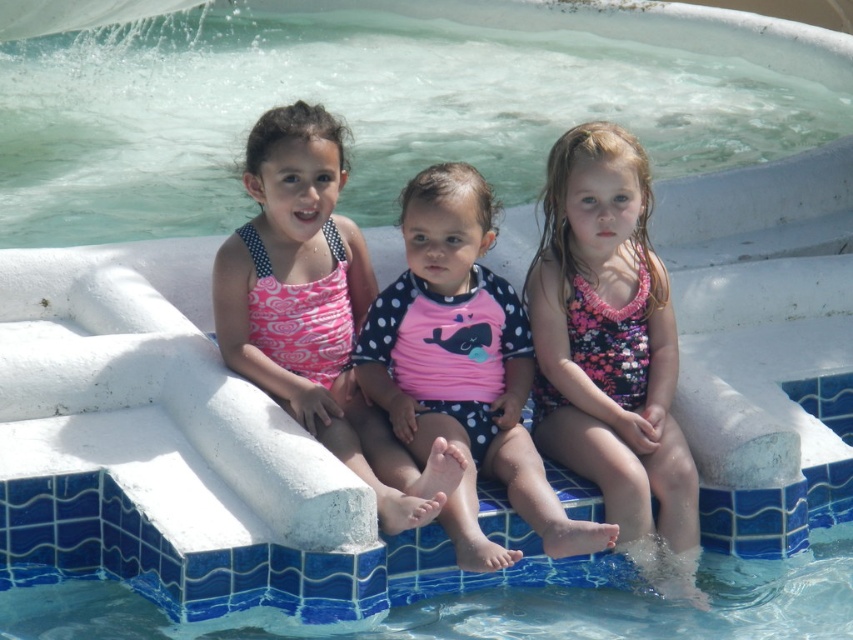
Consider the image. You are a lifeguard trying to ensure swimwear fits properly. You notice two children wearing pink swimsuits. One has a pink floral swimsuit at center and the other has a pink polka dot swimsuit at left. Which child is wearing the wider swimsuit?

The pink floral swimsuit at center is wider than the pink polka dot swimsuit at left, so the child wearing the pink floral swimsuit at center has the wider swimsuit.